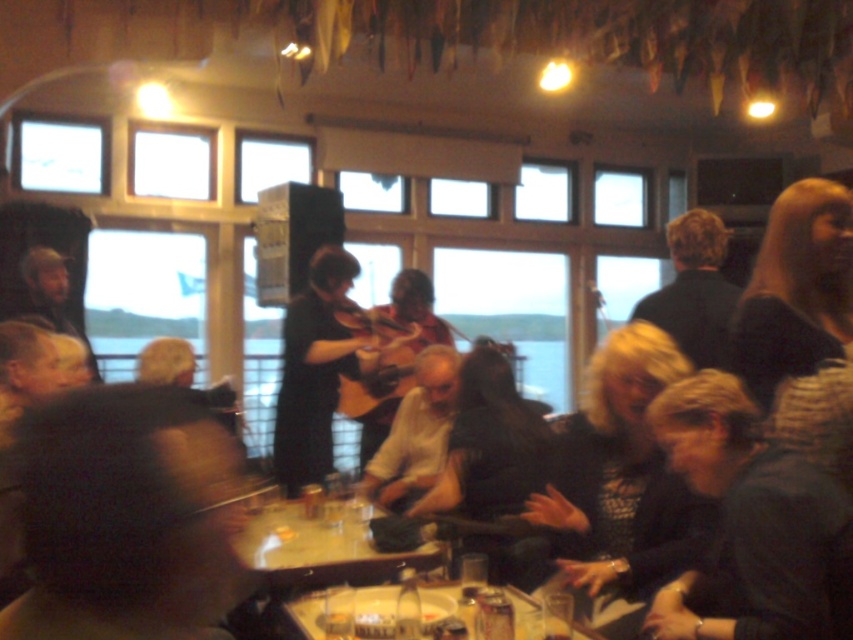
Question: Is black matte violin at center wider than black matte shirt at upper right?

Choices:
 (A) no
 (B) yes

Answer: (B)

Question: Which point is closer to the camera taking this photo?

Choices:
 (A) (746, 595)
 (B) (310, 620)

Answer: (A)

Question: Can you confirm if dark hair at lower left is positioned above dark gray sweater at center?

Choices:
 (A) no
 (B) yes

Answer: (B)

Question: Is wooden table at center wider than wooden acoustic guitar at center?

Choices:
 (A) no
 (B) yes

Answer: (B)

Question: Which point is closer to the camera?

Choices:
 (A) wooden table at center
 (B) dark hair at lower left

Answer: (B)

Question: Which object is farther from the camera taking this photo?

Choices:
 (A) dark gray sweater at center
 (B) black matte violin at center
 (C) dark hair at lower left
 (D) blonde hair at upper center

Answer: (B)